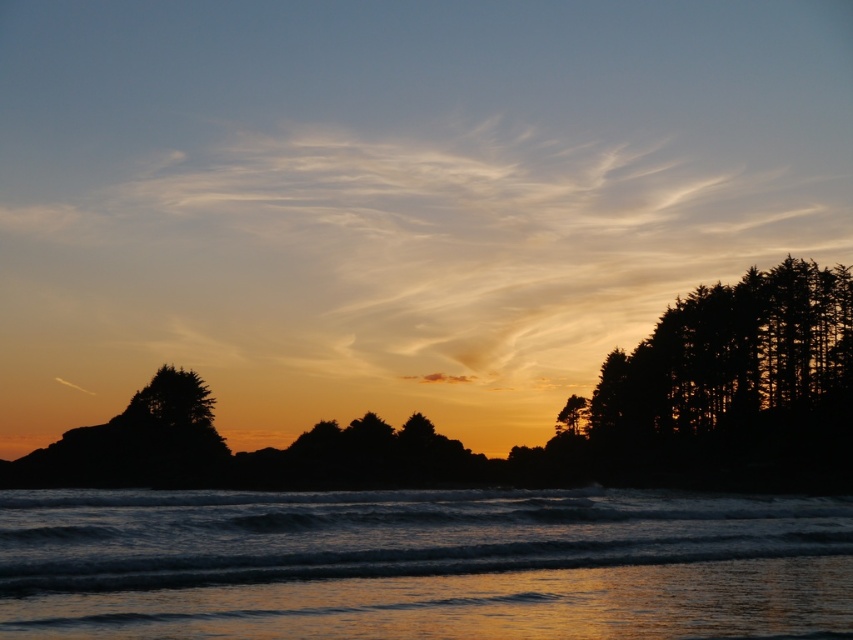
Does silhouette trees at right appear over green matte tree at center-right?

Yes, silhouette trees at right is above green matte tree at center-right.

Which is more to the right, silhouette trees at right or green matte tree at center-right?

silhouette trees at right

Does point (701, 442) lie behind point (556, 417)?

No, (701, 442) is in front of (556, 417).

Locate an element on the screen. This screenshot has width=853, height=640. silhouette trees at right is located at coordinates (734, 380).

Between shiny golden water at lower center and green matte tree at center-right, which one has more height?

With more height is green matte tree at center-right.

Is shiny golden water at lower center to the right of green matte tree at center-right from the viewer's perspective?

Incorrect, shiny golden water at lower center is not on the right side of green matte tree at center-right.

Locate an element on the screen. shiny golden water at lower center is located at coordinates (421, 564).

Does point (463, 570) come in front of point (657, 374)?

Yes, it is in front of point (657, 374).

This screenshot has width=853, height=640. In order to click on shiny golden water at lower center in this screenshot , I will do `click(421, 564)`.